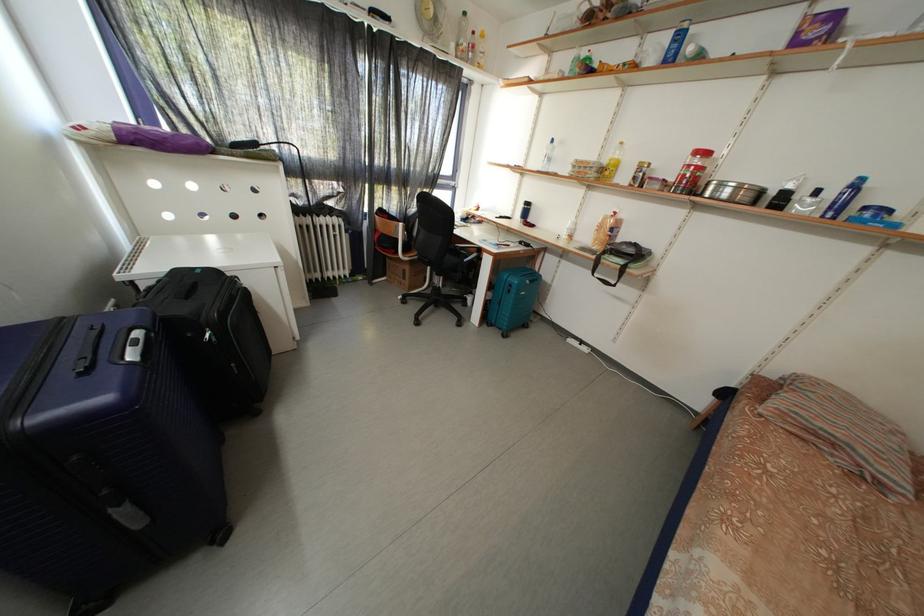
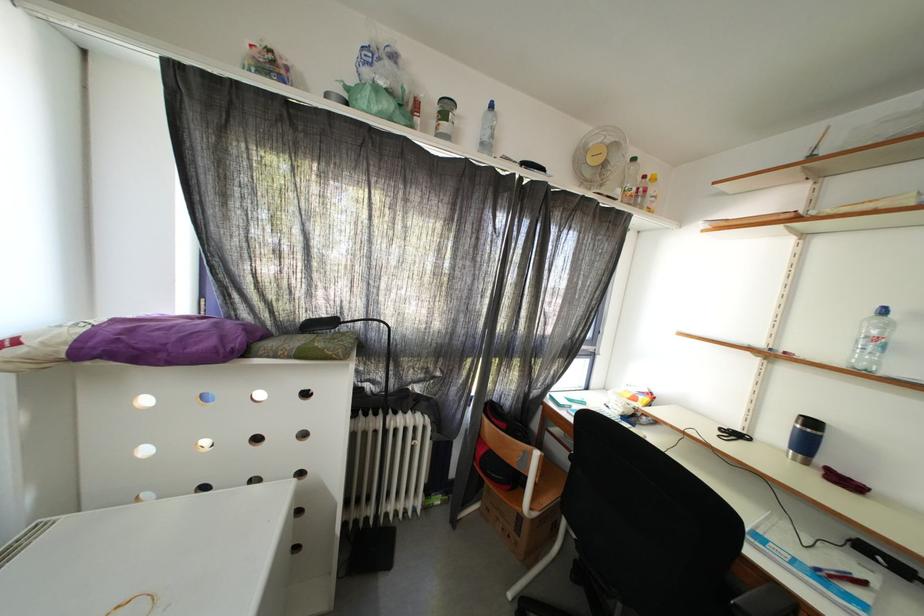
In the second image, find the point that corresponds to (x=408, y=230) in the first image.

(544, 458)